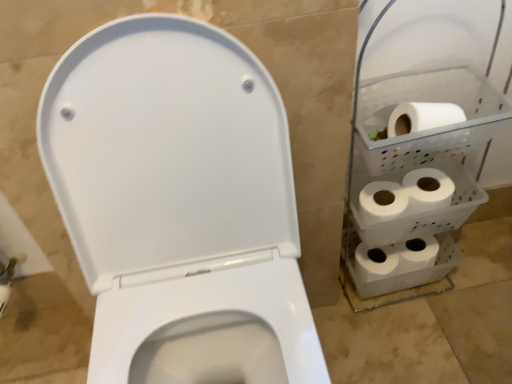
Question: From a real-world perspective, is white matte toilet paper at right, which is counted as the fourth toilet paper, starting from the right, on white matte toilet paper at right, which is the first toilet paper in right-to-left order?

Choices:
 (A) no
 (B) yes

Answer: (B)

Question: From the image's perspective, does white matte toilet paper at right, which is counted as the fourth toilet paper, starting from the right, appear higher than white matte toilet paper at right, which is the fourth toilet paper in left-to-right order?

Choices:
 (A) no
 (B) yes

Answer: (A)

Question: Is white matte toilet paper at right, the 1th toilet paper when ordered from left to right, at the left side of white matte toilet paper at right, which is the fourth toilet paper in left-to-right order?

Choices:
 (A) no
 (B) yes

Answer: (B)

Question: Considering the relative sizes of white matte toilet paper at right, which is counted as the fourth toilet paper, starting from the right, and white matte toilet paper at right, which is the first toilet paper in right-to-left order, in the image provided, is white matte toilet paper at right, which is counted as the fourth toilet paper, starting from the right, bigger than white matte toilet paper at right, which is the first toilet paper in right-to-left order,?

Choices:
 (A) no
 (B) yes

Answer: (B)

Question: Does white matte toilet paper at right, which is counted as the fourth toilet paper, starting from the right, have a greater width compared to white matte toilet paper at right, which is the fourth toilet paper in left-to-right order?

Choices:
 (A) no
 (B) yes

Answer: (B)

Question: Is white matte toilet paper at right, which is the fourth toilet paper in left-to-right order, completely or partially inside white matte toilet paper at right, which is counted as the fourth toilet paper, starting from the right?

Choices:
 (A) yes
 (B) no

Answer: (B)

Question: Is white matte toilet paper at right, which ranks as the 3th toilet paper in left-to-right order, smaller than white matte toilet paper at right, which is the fourth toilet paper in left-to-right order?

Choices:
 (A) yes
 (B) no

Answer: (A)

Question: Is white matte toilet paper at right, which ranks as the 3th toilet paper in left-to-right order, aimed at white matte toilet paper at right, which is the first toilet paper in right-to-left order?

Choices:
 (A) yes
 (B) no

Answer: (B)

Question: Is white matte toilet paper at right, which ranks as the 3th toilet paper in left-to-right order, next to white matte toilet paper at right, which is the fourth toilet paper in left-to-right order?

Choices:
 (A) yes
 (B) no

Answer: (B)

Question: Is the depth of white matte toilet paper at right, which ranks as the 3th toilet paper in left-to-right order, less than that of white matte toilet paper at right, which is the first toilet paper in right-to-left order?

Choices:
 (A) yes
 (B) no

Answer: (A)

Question: Considering the relative positions of white matte toilet paper at right, which ranks as the 2th toilet paper in right-to-left order, and white matte toilet paper at right, which is the first toilet paper in right-to-left order, in the image provided, is white matte toilet paper at right, which ranks as the 2th toilet paper in right-to-left order, to the left of white matte toilet paper at right, which is the first toilet paper in right-to-left order, from the viewer's perspective?

Choices:
 (A) no
 (B) yes

Answer: (B)

Question: Would you say white matte toilet paper at right, which ranks as the 3th toilet paper in left-to-right order, is outside white matte toilet paper at right, which is the fourth toilet paper in left-to-right order?

Choices:
 (A) yes
 (B) no

Answer: (A)

Question: Considering the relative sizes of white matte toilet paper at right, which is the first toilet paper in right-to-left order, and white matte toilet paper at right, which is counted as the fourth toilet paper, starting from the right, in the image provided, is white matte toilet paper at right, which is the first toilet paper in right-to-left order, bigger than white matte toilet paper at right, which is counted as the fourth toilet paper, starting from the right,?

Choices:
 (A) yes
 (B) no

Answer: (B)